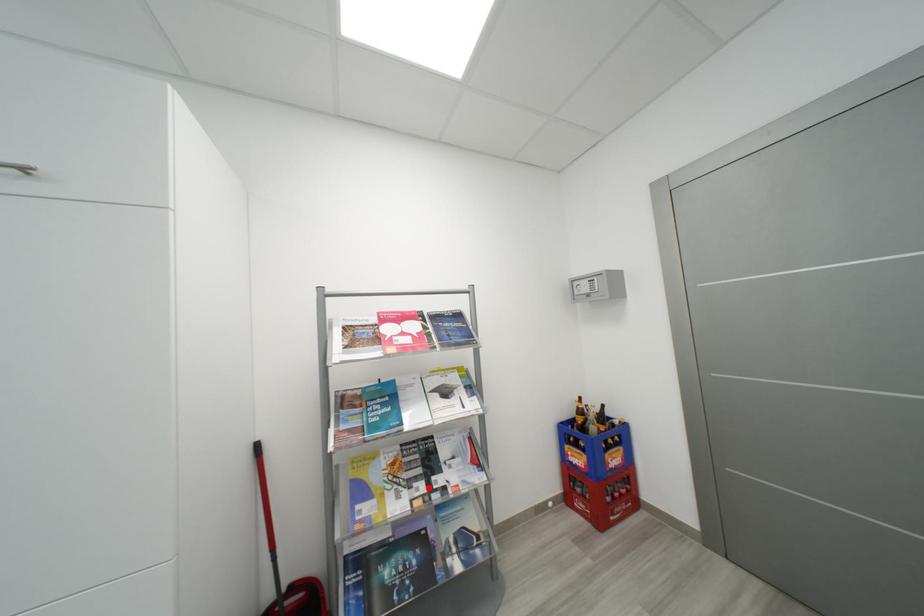
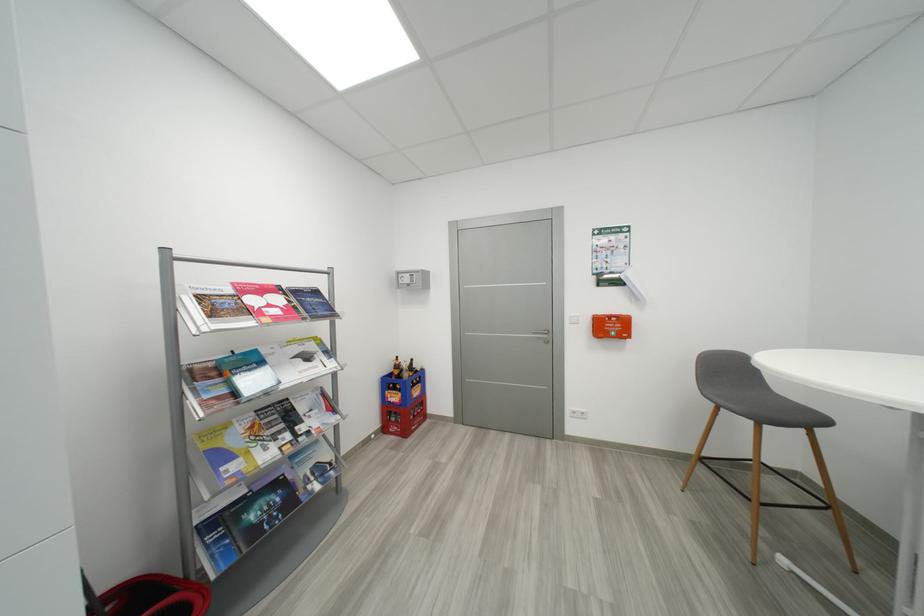
Question: A red point is marked in image1. In image2, is the corresponding 3D point closer to the camera or farther? Reply with the corresponding letter.

Choices:
 (A) The corresponding 3D point is closer.
 (B) The corresponding 3D point is farther.

Answer: (A)